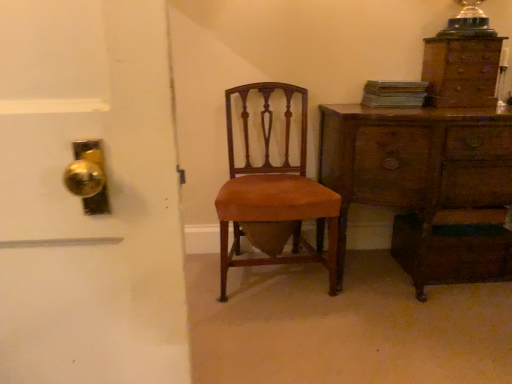
The image size is (512, 384). Find the location of `free spot in front of brown wood chair at center`. free spot in front of brown wood chair at center is located at coordinates (289, 334).